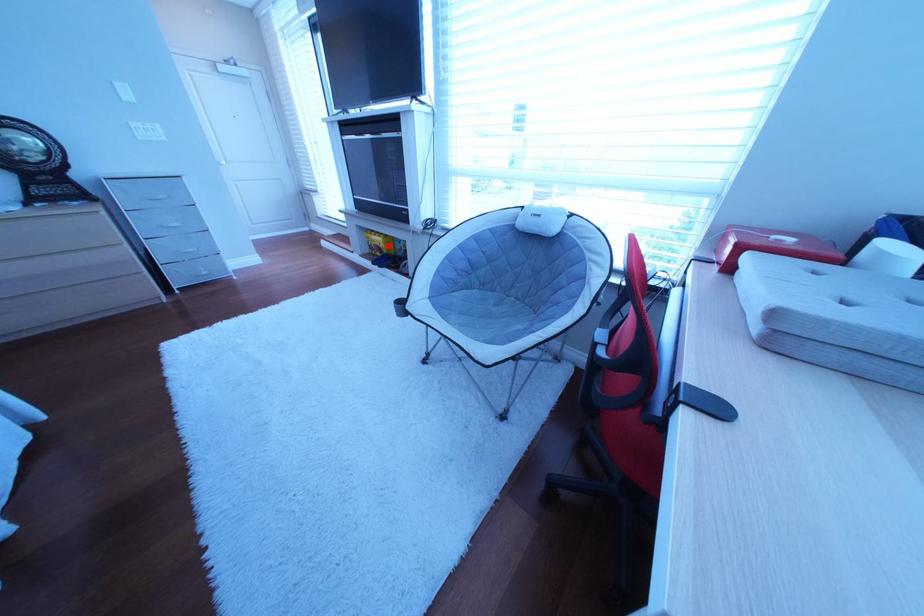
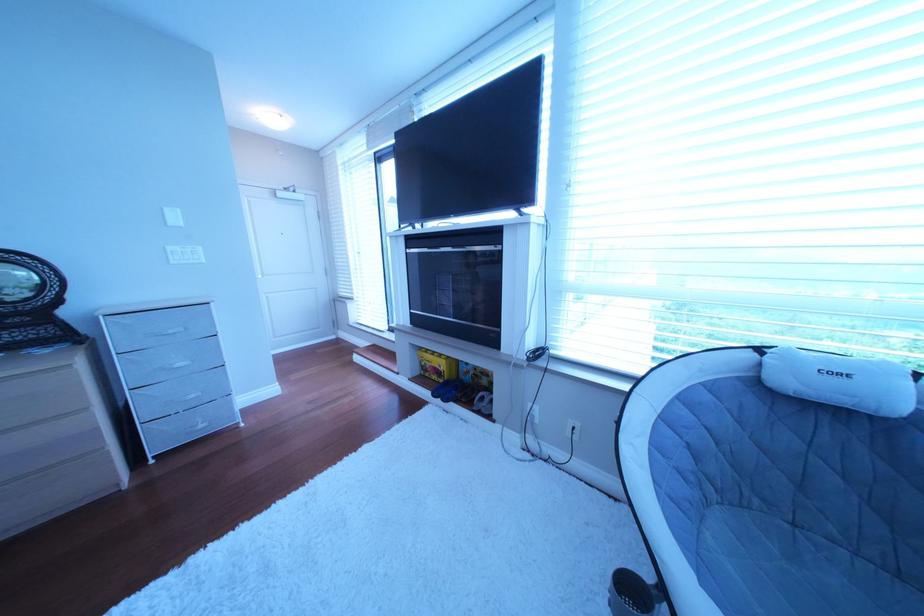
The point at the highlighted location is marked in the first image. Where is the corresponding point in the second image?

(444, 367)